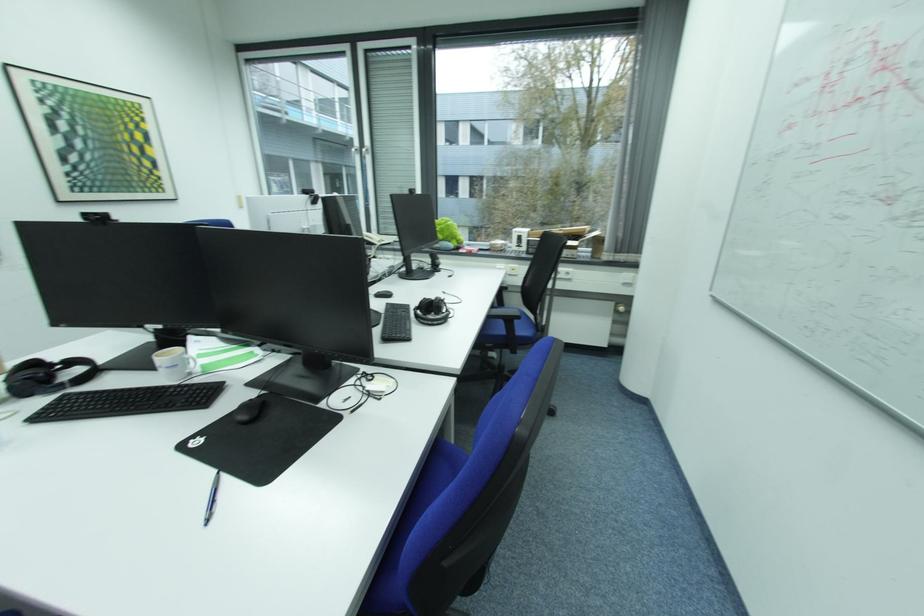
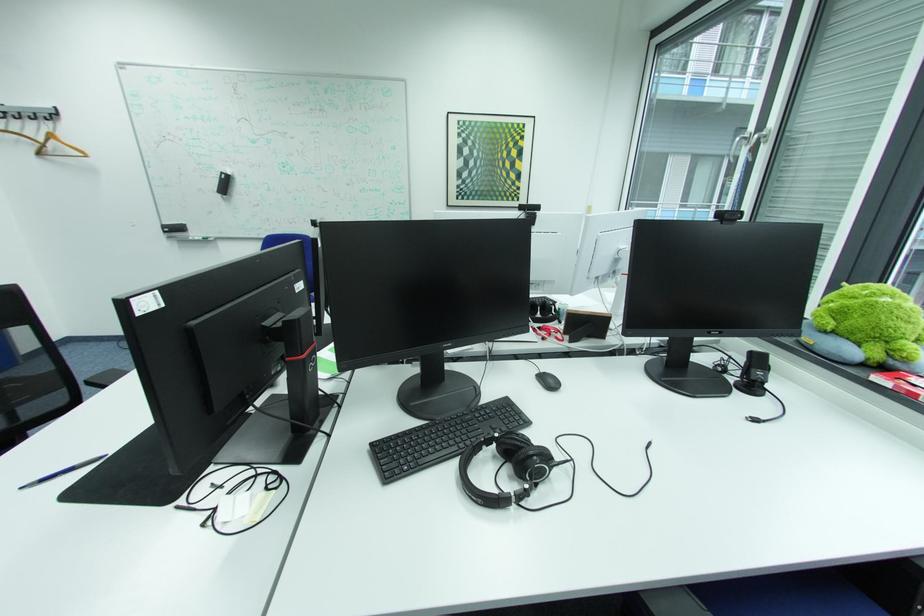
Find the pixel in the second image that matches point 465,249 in the first image.

(882, 365)